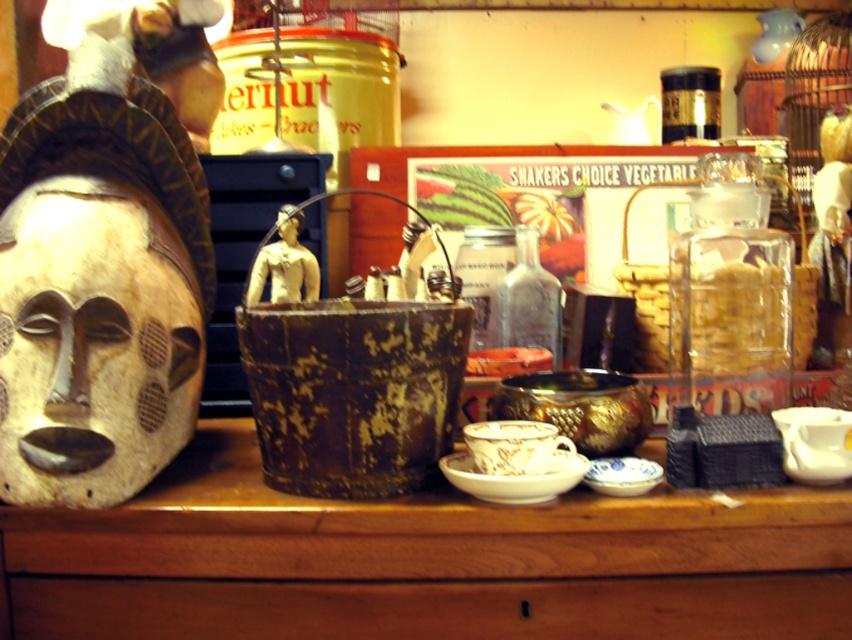
Question: Can you confirm if wooden table at center is smaller than wooden mask at left?

Choices:
 (A) no
 (B) yes

Answer: (A)

Question: Is wooden table at center above wooden mask at left?

Choices:
 (A) no
 (B) yes

Answer: (A)

Question: Which point appears closest to the camera in this image?

Choices:
 (A) pos(118,392)
 (B) pos(286,205)

Answer: (A)

Question: Which of the following is the farthest from the observer?

Choices:
 (A) (844, 541)
 (B) (298, 218)

Answer: (B)

Question: Which of these objects is positioned farthest from the wooden table at center?

Choices:
 (A) wooden mask at left
 (B) matte yellow head at center

Answer: (B)

Question: Is the position of wooden table at center less distant than that of wooden mask at left?

Choices:
 (A) yes
 (B) no

Answer: (B)